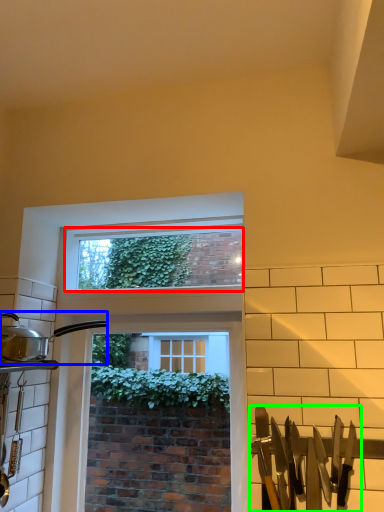
Question: Considering the real-world distances, which object is farthest from window screen (highlighted by a red box)? kitchen appliance (highlighted by a blue box) or silverware (highlighted by a green box)?

Choices:
 (A) kitchen appliance
 (B) silverware

Answer: (B)